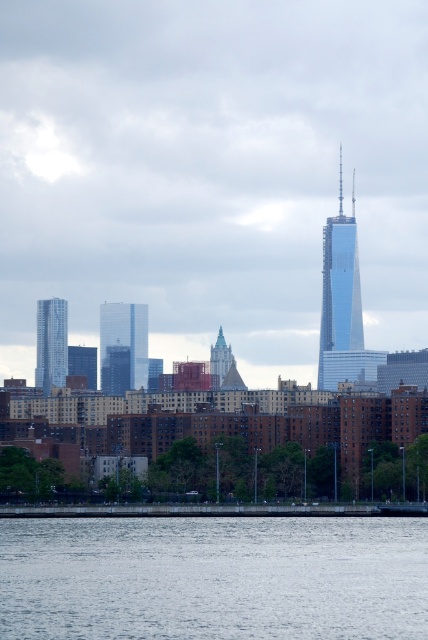
Is gray water at lower center taller than matte teal glass tower at center?

Yes.

Who is positioned more to the left, gray water at lower center or matte teal glass tower at center?

→ gray water at lower center

This screenshot has height=640, width=428. What are the coordinates of `gray water at lower center` in the screenshot? It's located at (214, 579).

Is point (32, 554) closer to viewer compared to point (369, 349)?

That is False.

Is point (312, 589) in front of point (329, 317)?

No, it is not.

At what (x,y) coordinates should I click in order to perform the action: click on gray water at lower center. Please return your answer as a coordinate pair (x, y). Image resolution: width=428 pixels, height=640 pixels. Looking at the image, I should click on (214, 579).

Can you confirm if shiny glass skyscraper at center is positioned below glassy reflective skyscraper at center?

Incorrect, shiny glass skyscraper at center is not positioned below glassy reflective skyscraper at center.

Does shiny glass skyscraper at center have a greater height compared to glassy reflective skyscraper at center?

Yes.

Find the location of a particular element. This screenshot has height=640, width=428. shiny glass skyscraper at center is located at coordinates (342, 301).